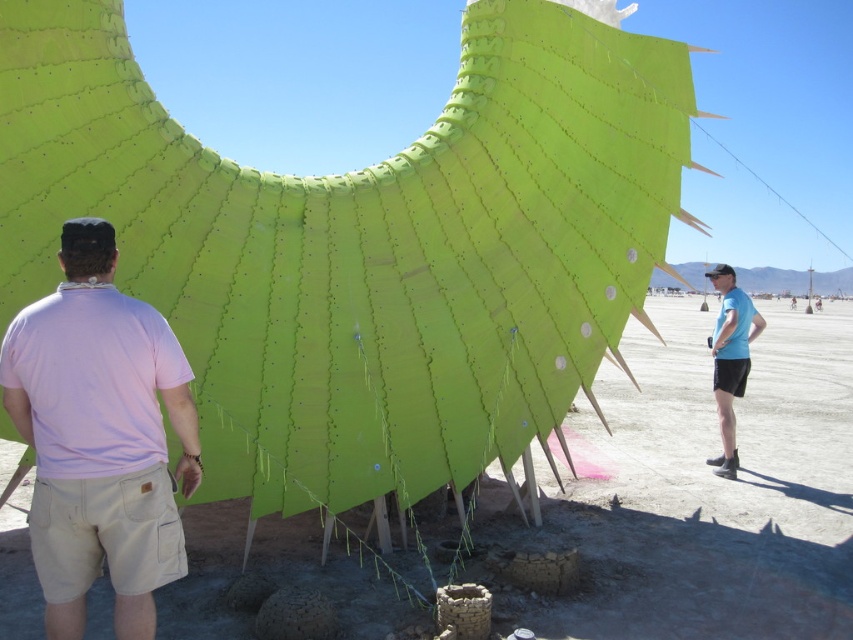
Question: Where is pink cotton shirt at left located in relation to blue fabric shirt at right in the image?

Choices:
 (A) below
 (B) above

Answer: (A)

Question: Does pink cotton shirt at left have a lesser width compared to blue fabric shirt at right?

Choices:
 (A) no
 (B) yes

Answer: (B)

Question: Among these objects, which one is nearest to the camera?

Choices:
 (A) blue fabric shirt at right
 (B) pink cotton shirt at left

Answer: (B)

Question: Among these objects, which one is nearest to the camera?

Choices:
 (A) pink cotton shirt at left
 (B) blue fabric shirt at right

Answer: (A)

Question: Is pink cotton shirt at left thinner than blue fabric shirt at right?

Choices:
 (A) no
 (B) yes

Answer: (B)